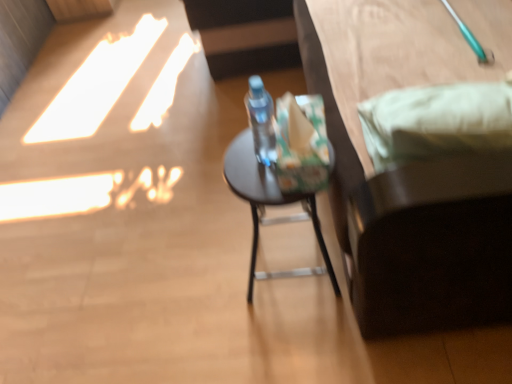
At what (x,y) coordinates should I click in order to perform the action: click on free spot above matte black stool at center (from a real-world perspective). Please return your answer as a coordinate pair (x, y). The height and width of the screenshot is (384, 512). Looking at the image, I should click on (263, 165).